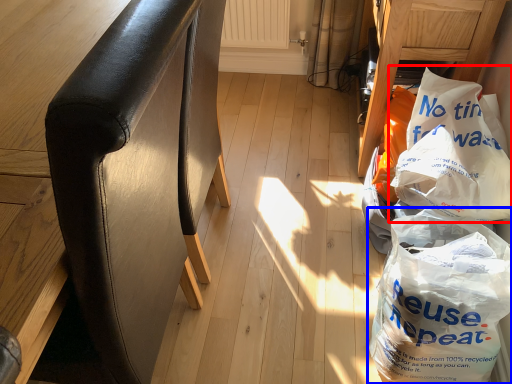
Question: Which object appears closest to the camera in this image, plastic bag (highlighted by a red box) or plastic bag (highlighted by a blue box)?

Choices:
 (A) plastic bag
 (B) plastic bag

Answer: (B)